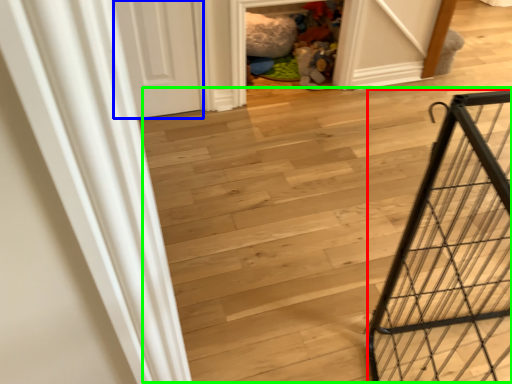
Question: Based on their relative distances, which object is farther from cage (highlighted by a red box)? Choose from door (highlighted by a blue box) and stairwell (highlighted by a green box).

Choices:
 (A) door
 (B) stairwell

Answer: (A)